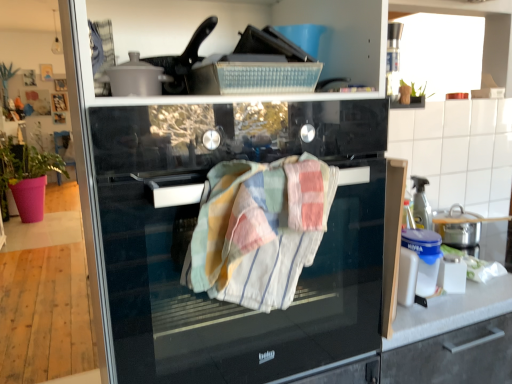
Question: From the image's perspective, is pink fabric plant at left located above or below multicolored woven towel at center?

Choices:
 (A) above
 (B) below

Answer: (A)

Question: In the image, is pink fabric plant at left positioned in front of or behind multicolored woven towel at center?

Choices:
 (A) front
 (B) behind

Answer: (B)

Question: Estimate the real-world distances between objects in this image. Which object is closer to the black glass oven at center?

Choices:
 (A) pink fabric plant at left
 (B) multicolored woven towel at center

Answer: (B)

Question: Which object is positioned closest to the multicolored woven towel at center?

Choices:
 (A) black glass oven at center
 (B) pink fabric plant at left

Answer: (A)